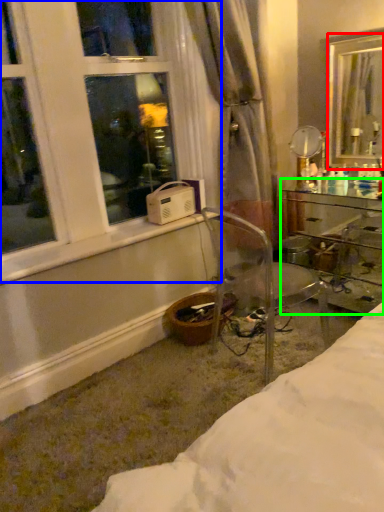
Question: Estimate the real-world distances between objects in this image. Which object is closer to mirror (highlighted by a red box), window (highlighted by a blue box) or desk (highlighted by a green box)?

Choices:
 (A) window
 (B) desk

Answer: (B)